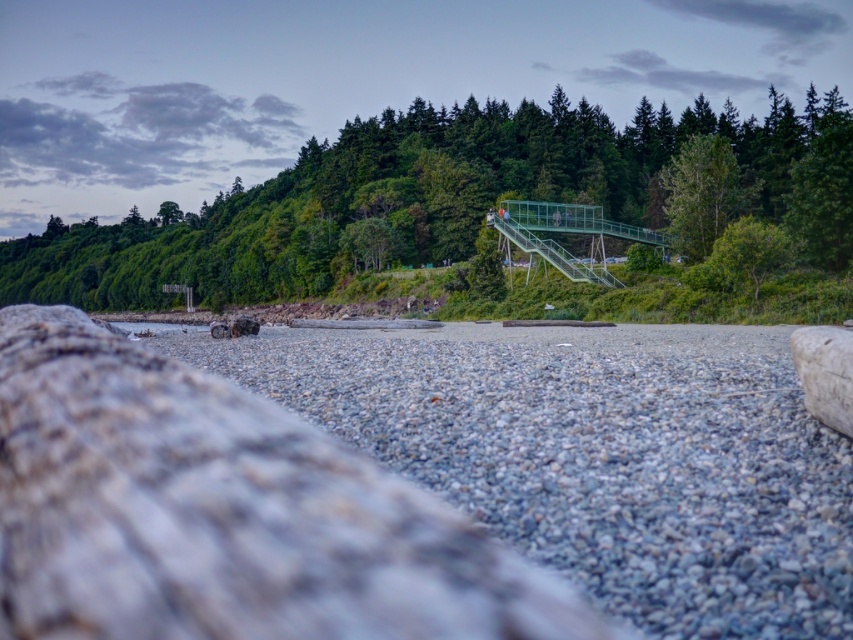
You are a hiker who wants to cross from the gray rough wood at center to the green metallic bridge at upper center. Given that your average walking speed is 1.5 meters per second, how long will it take you to reach the bridge?

The distance between the gray rough wood at center and the green metallic bridge at upper center is 107.69 meters. At a walking speed of 1.5 meters per second, it will take approximately 71.79 seconds, which is roughly 1 minute and 12 seconds, to reach the bridge.

You are standing on the pebble beach in the foreground and want to reach the green metallic bridge at upper center. According to the coordinates provided, what direction should you head towards from your current position?

The green metallic bridge at upper center is located at coordinates point (445,196), so you should head towards the upper center direction from your current position on the pebble beach to reach it.